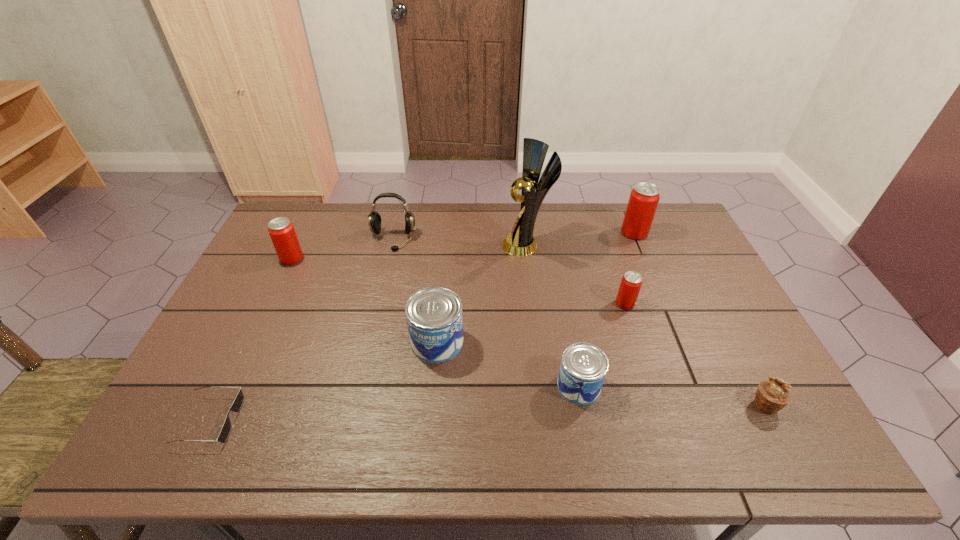
Where is `vacant space that is in between the black award and the farther blue can`? vacant space that is in between the black award and the farther blue can is located at coordinates (482, 294).

Select which object is the third closest to the seventh object from right to left. Please provide its 2D coordinates. Your answer should be formatted as a tuple, i.e. [(x, y)], where the tuple contains the x and y coordinates of a point satisfying the conditions above.

[(434, 318)]

Select which object appears as the closest to the rightmost object. Please provide its 2D coordinates. Your answer should be formatted as a tuple, i.e. [(x, y)], where the tuple contains the x and y coordinates of a point satisfying the conditions above.

[(631, 282)]

This screenshot has width=960, height=540. Find the location of `can that is the second closest to the tallest object`. can that is the second closest to the tallest object is located at coordinates (644, 198).

Point out which can is positioned as the fourth nearest to the seventh object from right to left. Please provide its 2D coordinates. Your answer should be formatted as a tuple, i.e. [(x, y)], where the tuple contains the x and y coordinates of a point satisfying the conditions above.

[(631, 282)]

Point out which red can is positioned as the third nearest to the sunglasses. Please provide its 2D coordinates. Your answer should be formatted as a tuple, i.e. [(x, y)], where the tuple contains the x and y coordinates of a point satisfying the conditions above.

[(644, 198)]

Identify which red can is located as the third nearest to the smaller blue can. Please provide its 2D coordinates. Your answer should be formatted as a tuple, i.e. [(x, y)], where the tuple contains the x and y coordinates of a point satisfying the conditions above.

[(281, 230)]

Locate an element on the screen. free space that satisfies the following two spatial constraints: 1. at the front of the black award, where the globe is visible; 2. on the left side of the nearest red can is located at coordinates (534, 303).